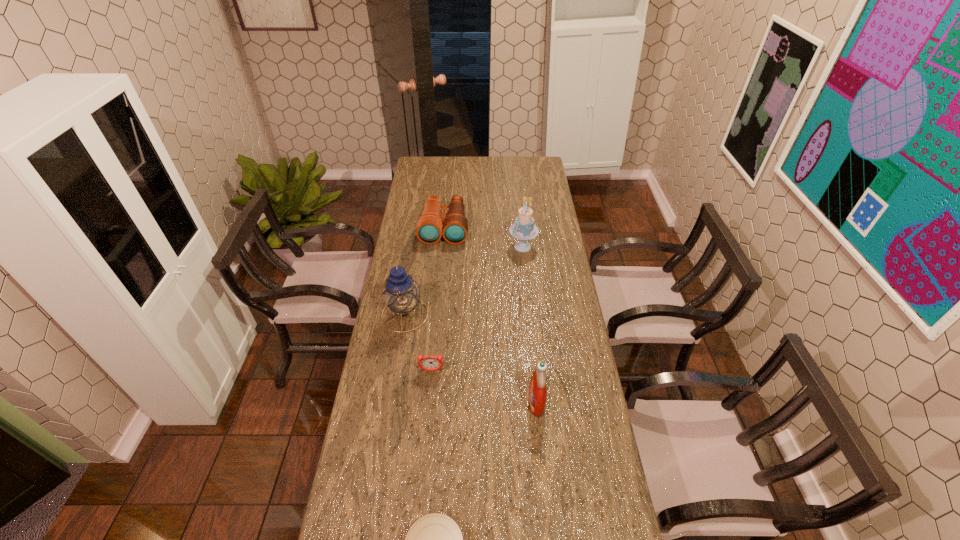
Where is `cake`? cake is located at coordinates (x=524, y=229).

Locate an element on the screen. lantern is located at coordinates (401, 293).

I want to click on detergent, so click(x=537, y=390).

I want to click on the fifth farthest object, so click(x=537, y=390).

You are a GUI agent. You are given a task and a screenshot of the screen. Output one action in this format:
    pyautogui.click(x=<x>, y=<y>)
    Task: Click on the binoculars
    This screenshot has height=540, width=960.
    Given the screenshot: What is the action you would take?
    pyautogui.click(x=429, y=230)

Locate an element on the screen. The height and width of the screenshot is (540, 960). the third nearest object is located at coordinates (429, 363).

This screenshot has width=960, height=540. What are the coordinates of `free space located with a ladder on the side of the cake` in the screenshot? It's located at (442, 247).

The image size is (960, 540). In order to click on free space located with a ladder on the side of the cake in this screenshot , I will do `click(428, 247)`.

This screenshot has height=540, width=960. I want to click on free space located 0.120m with a ladder on the side of the cake, so click(482, 247).

Image resolution: width=960 pixels, height=540 pixels. I want to click on vacant space located on the front-facing side of the third farthest object, so click(x=442, y=315).